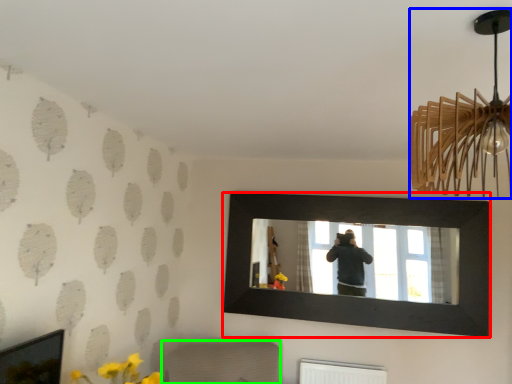
Question: Which is nearer to the picture frame (highlighted by a red box)? lamp (highlighted by a blue box) or furniture (highlighted by a green box).

Choices:
 (A) lamp
 (B) furniture

Answer: (B)